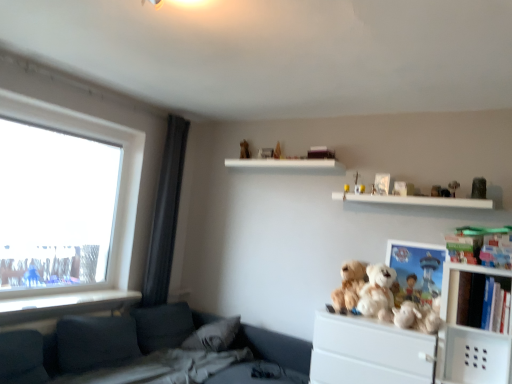
Question: Is white plastic cabinet at right to the left of white plush bear at upper center, acting as the third toy starting from the right, from the viewer's perspective?

Choices:
 (A) no
 (B) yes

Answer: (A)

Question: Considering the relative positions of white plastic cabinet at right and white plush bear at upper center, acting as the third toy starting from the right, in the image provided, is white plastic cabinet at right behind white plush bear at upper center, acting as the third toy starting from the right,?

Choices:
 (A) yes
 (B) no

Answer: (B)

Question: Is white plastic cabinet at right outside of white plush bear at upper center, acting as the third toy starting from the right?

Choices:
 (A) no
 (B) yes

Answer: (B)

Question: Is white plastic cabinet at right thinner than white plush bear at upper center, acting as the third toy starting from the right?

Choices:
 (A) yes
 (B) no

Answer: (B)

Question: Can you confirm if white plastic cabinet at right is smaller than white plush bear at upper center, acting as the third toy starting from the right?

Choices:
 (A) no
 (B) yes

Answer: (A)

Question: Considering the positions of white plush toy at upper right, which is the fourth toy from right to left, and gray fabric pillow at lower left in the image, is white plush toy at upper right, which is the fourth toy from right to left, wider or thinner than gray fabric pillow at lower left?

Choices:
 (A) thin
 (B) wide

Answer: (A)

Question: From the image's perspective, relative to gray fabric pillow at lower left, is white plush toy at upper right, which is the fourth toy from right to left, above or below?

Choices:
 (A) above
 (B) below

Answer: (A)

Question: Considering the positions of point click(437, 195) and point click(224, 342), is point click(437, 195) closer or farther from the camera than point click(224, 342)?

Choices:
 (A) closer
 (B) farther

Answer: (A)

Question: From their relative heights in the image, would you say white plush toy at upper right, which is the fourth toy from right to left, is taller or shorter than gray fabric pillow at lower left?

Choices:
 (A) short
 (B) tall

Answer: (A)

Question: From a real-world perspective, is pastel pink plastic blocks at upper right, which is the first toy in right-to-left order, above or below white plush bear at upper center, acting as the 6th toy starting from the left?

Choices:
 (A) above
 (B) below

Answer: (B)

Question: Based on their positions, is pastel pink plastic blocks at upper right, positioned as the eighth toy in left-to-right order, located to the left or right of white plush bear at upper center, acting as the 6th toy starting from the left?

Choices:
 (A) right
 (B) left

Answer: (A)

Question: Is pastel pink plastic blocks at upper right, which is the first toy in right-to-left order, wider or thinner than white plush bear at upper center, acting as the 6th toy starting from the left?

Choices:
 (A) wide
 (B) thin

Answer: (A)

Question: Considering their positions, is pastel pink plastic blocks at upper right, which is the first toy in right-to-left order, located in front of or behind white plush bear at upper center, acting as the third toy starting from the right?

Choices:
 (A) front
 (B) behind

Answer: (A)

Question: Considering their positions, is fluffy white teddy bear at center-right, which is counted as the 4th toy, starting from the left, located in front of or behind white plush bear at upper right, acting as the 2th toy starting from the right?

Choices:
 (A) behind
 (B) front

Answer: (A)

Question: In terms of size, does fluffy white teddy bear at center-right, which is counted as the 5th toy, starting from the right, appear bigger or smaller than white plush bear at upper right, positioned as the 7th toy in left-to-right order?

Choices:
 (A) big
 (B) small

Answer: (A)